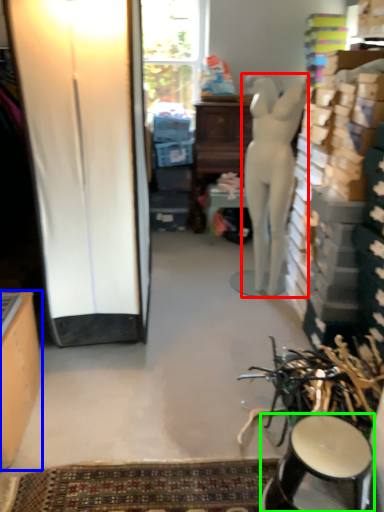
Question: Estimate the real-world distances between objects in this image. Which object is closer to person (highlighted by a red box), cabinetry (highlighted by a blue box) or stool (highlighted by a green box)?

Choices:
 (A) cabinetry
 (B) stool

Answer: (B)